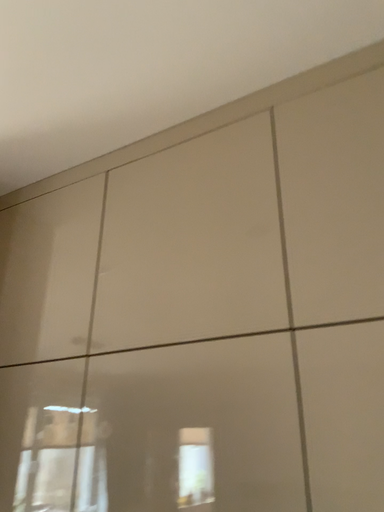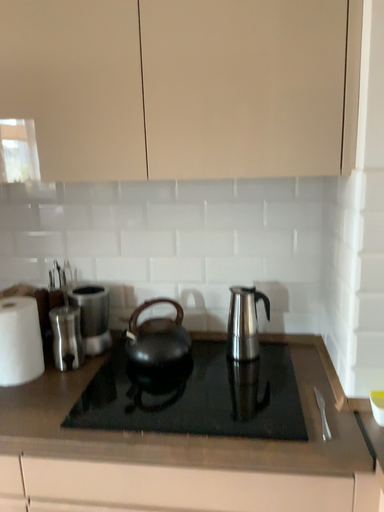
Question: How did the camera likely rotate when shooting the video?

Choices:
 (A) rotated left
 (B) rotated right

Answer: (B)